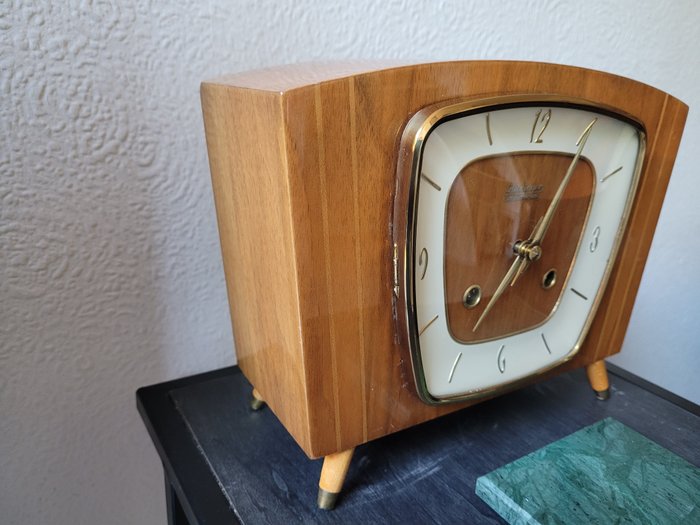
Where is `white textured wall bottom right of photo`? white textured wall bottom right of photo is located at coordinates (675, 345).